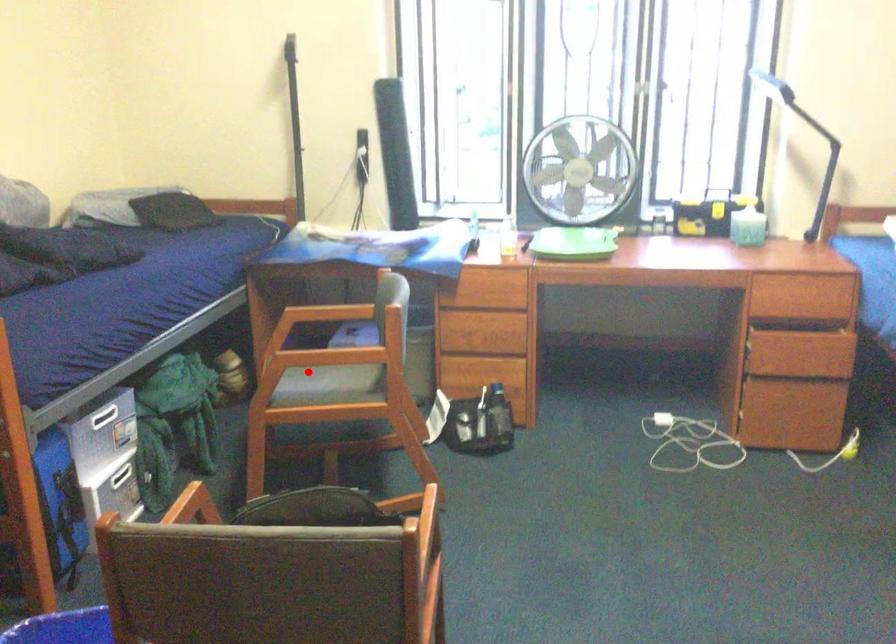
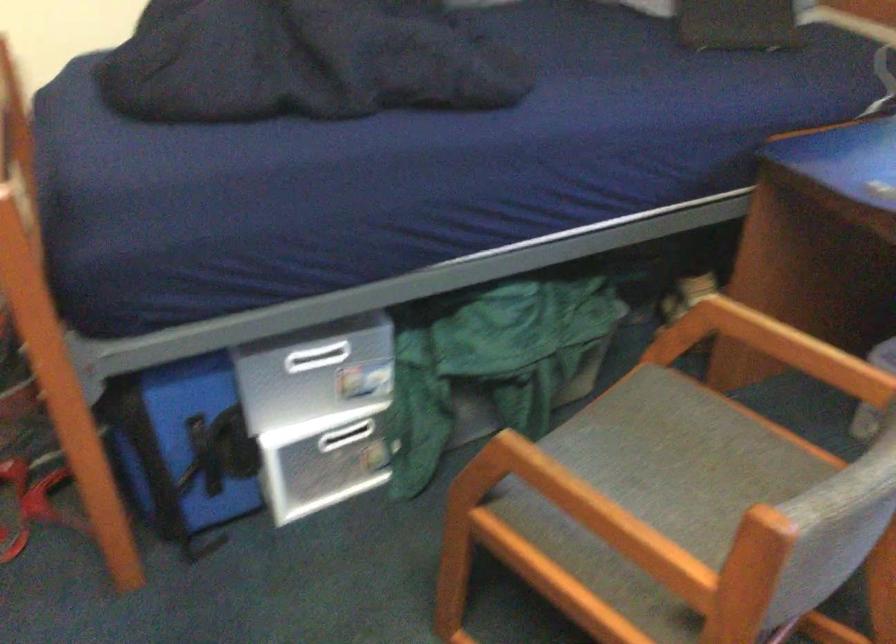
Question: I am providing you with two images of the same scene from different viewpoints. Image1 has a red point marked. In image2, the corresponding 3D location appears at what relative position? Reply with the corresponding letter.

Choices:
 (A) Closer
 (B) Farther

Answer: (A)